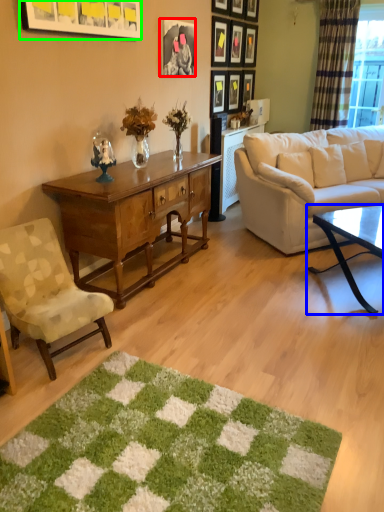
Question: Which object is positioned closest to picture frame (highlighted by a red box)? Select from coffee table (highlighted by a blue box) and picture frame (highlighted by a green box).

Choices:
 (A) coffee table
 (B) picture frame

Answer: (B)